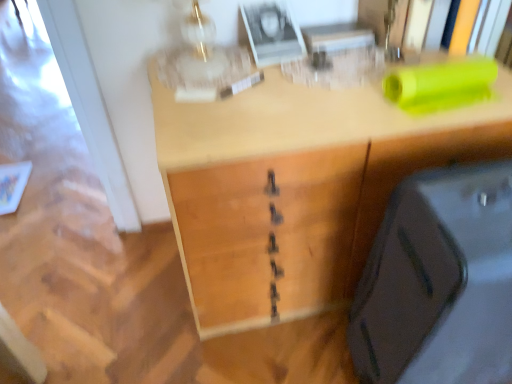
Where is `free spot above wooden desk at center (from a real-world perspective)`? The height and width of the screenshot is (384, 512). free spot above wooden desk at center (from a real-world perspective) is located at coordinates (306, 84).